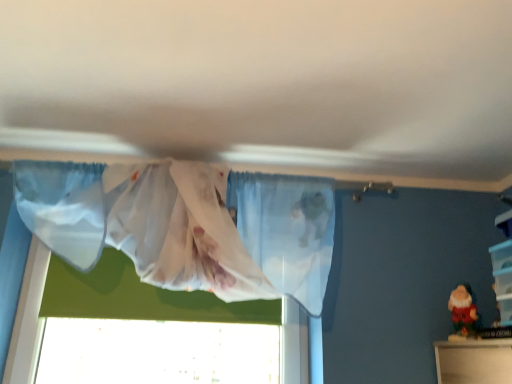
Question: Does matte plastic santa at lower right have a lesser width compared to translucent fabric curtain at upper center?

Choices:
 (A) yes
 (B) no

Answer: (A)

Question: Is matte plastic santa at lower right directly adjacent to translucent fabric curtain at upper center?

Choices:
 (A) yes
 (B) no

Answer: (B)

Question: Can you confirm if matte plastic santa at lower right is bigger than translucent fabric curtain at upper center?

Choices:
 (A) yes
 (B) no

Answer: (B)

Question: Is matte plastic santa at lower right at the left side of translucent fabric curtain at upper center?

Choices:
 (A) no
 (B) yes

Answer: (A)

Question: Can you confirm if matte plastic santa at lower right is shorter than translucent fabric curtain at upper center?

Choices:
 (A) yes
 (B) no

Answer: (A)

Question: Is matte plastic santa at lower right oriented towards translucent fabric curtain at upper center?

Choices:
 (A) no
 (B) yes

Answer: (B)

Question: Considering the relative sizes of translucent fabric curtain at upper center and matte plastic santa at lower right in the image provided, is translucent fabric curtain at upper center thinner than matte plastic santa at lower right?

Choices:
 (A) yes
 (B) no

Answer: (B)

Question: From the image's perspective, is translucent fabric curtain at upper center on top of matte plastic santa at lower right?

Choices:
 (A) no
 (B) yes

Answer: (B)

Question: Is translucent fabric curtain at upper center wider than matte plastic santa at lower right?

Choices:
 (A) yes
 (B) no

Answer: (A)

Question: Is translucent fabric curtain at upper center at the right side of matte plastic santa at lower right?

Choices:
 (A) yes
 (B) no

Answer: (B)

Question: Does translucent fabric curtain at upper center come behind matte plastic santa at lower right?

Choices:
 (A) yes
 (B) no

Answer: (B)

Question: Is translucent fabric curtain at upper center positioned far away from matte plastic santa at lower right?

Choices:
 (A) yes
 (B) no

Answer: (B)

Question: Considering the relative sizes of matte plastic santa at lower right and clear plastic storage at right in the image provided, is matte plastic santa at lower right shorter than clear plastic storage at right?

Choices:
 (A) no
 (B) yes

Answer: (B)